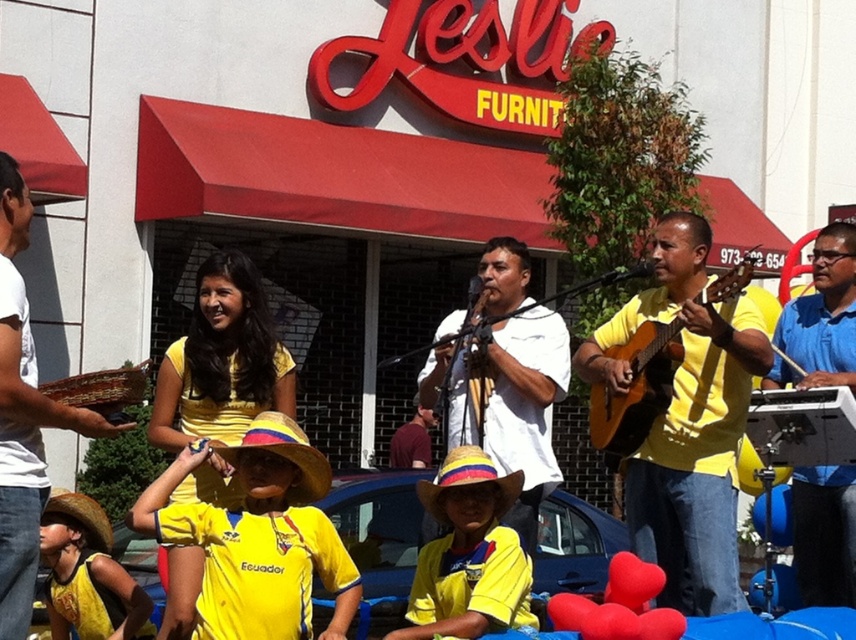
You are a photographer standing at the center of the scene. You want to take a photo that includes both the point at coordinates point (520, 529) and point (4, 184). Since you need to focus on the closer object first, which point should you focus on first?

Point (4, 184) is closer to the photographer than point (520, 529), so you should focus on point (4, 184) first.

You are a photographer trying to capture the matte yellow shirt at center in your shot. Based on its position at point 0.659, 0.803, where should you aim your camera?

The matte yellow shirt at center is located at point (687, 420), so you should aim your camera towards the lower central area of the scene to capture it.

You are organizing a music performance and need to place the white matte guitar at center and the white woven basket at left on a narrow stage. Which object requires more horizontal space?

The white matte guitar at center might require more horizontal space than the white woven basket at left since it is wider.